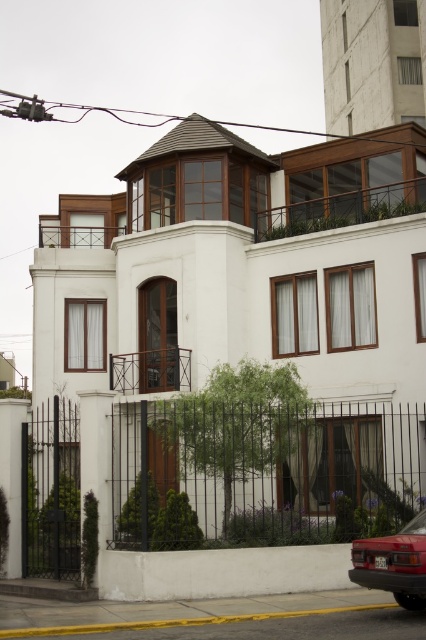
You are a delivery person arriving at the modern residential building. You need to park your matte red car at lower right near the entrance. Is the space between the black wrought iron fence at lower left and the building wide enough for your car to maneuver?

The black wrought iron fence at lower left is bigger than the matte red car at lower right, so the space between the fence and the building may be sufficient for the car to maneuver, but the exact width isn

Based on the photo, you are a delivery person standing at the black wrought iron fence at lower left and need to reach the matte red car at lower right. The delivery cart you are using has a turning radius of 10 feet. Can you navigate around the space between them without hitting either object?

The distance between the black wrought iron fence at lower left and the matte red car at lower right is 26.70 feet. Since the delivery cart requires a turning radius of 10 feet, which is less than the available space, you can navigate around them without any issues.

You are a delivery person approaching the building and need to park your matte red car at lower right. The black wrought iron fence at lower left is in the way. Can you estimate if there is enough space between the fence and the building to park your car?

The black wrought iron fence at lower left is wider than the matte red car at lower right. Since the fence is wider, there might be sufficient space between the fence and the building to park the car, but this depends on the total available area. However, based on the width comparison alone, the car is narrower than the fence, so it could fit within the space if positioned correctly.